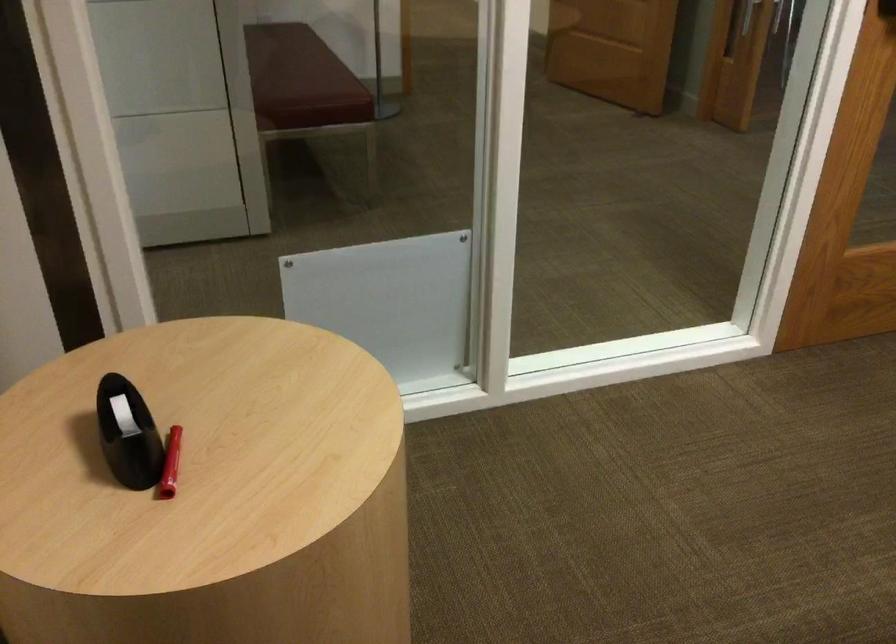
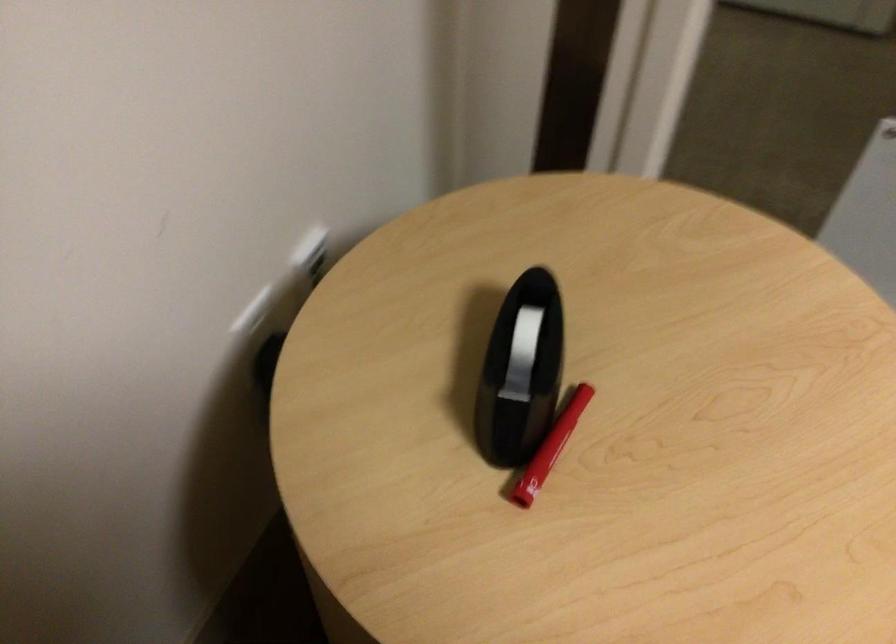
Locate, in the second image, the point that corresponds to (175,506) in the first image.

(527, 511)